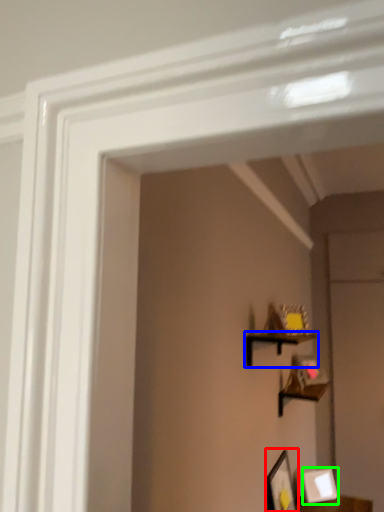
Question: Estimate the real-world distances between objects in this image. Which object is farther from picture frame (highlighted by a red box), shelf (highlighted by a blue box) or picture frame (highlighted by a green box)?

Choices:
 (A) shelf
 (B) picture frame

Answer: (A)